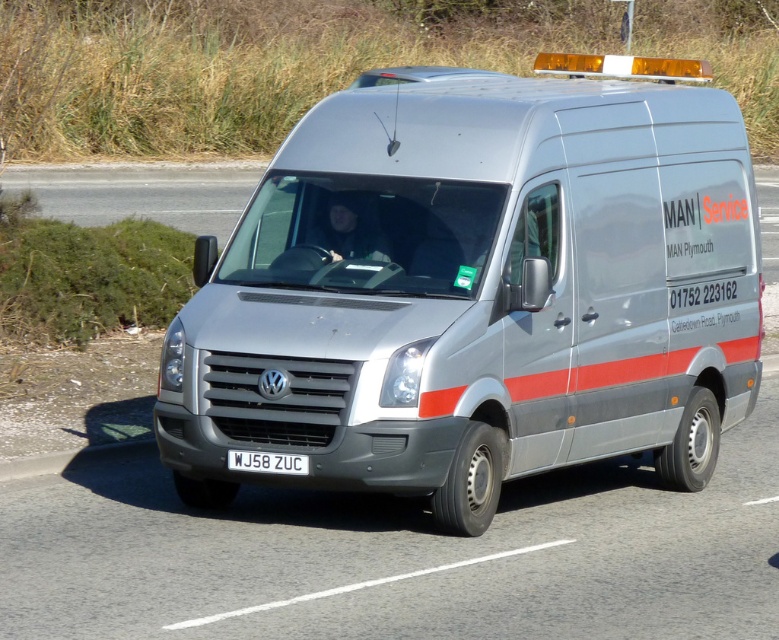
You are a traffic officer observing a vehicle. You notice a satin silver van at center and a white plastic license plate at center. Which object is closer to you?

The satin silver van at center is positioned over white plastic license plate at center, so the satin silver van at center is closer to you.

You are a traffic officer observing a vehicle. You notice the satin silver van at center and the white plastic license plate at center. Which object is positioned more to the right?

The white plastic license plate at center is positioned more to the right than the satin silver van at center.

You are a pedestrian standing on the sidewalk. You see the satin silver van at center and the white plastic license plate at center. Which object is closer to you?

The white plastic license plate at center is behind the satin silver van at center, so the satin silver van at center is closer to you.